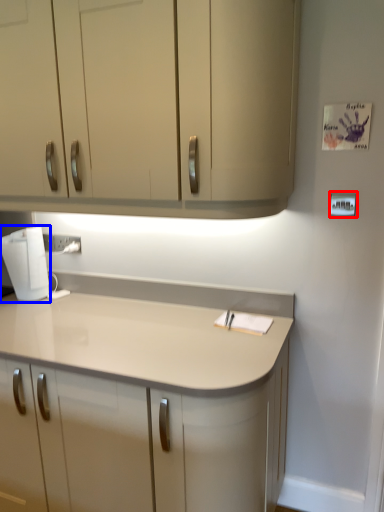
Question: Which of the following is the farthest to the observer, light switch (highlighted by a red box) or home appliance (highlighted by a blue box)?

Choices:
 (A) light switch
 (B) home appliance

Answer: (B)